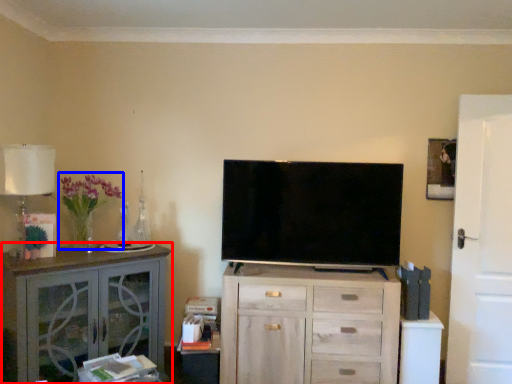
Question: Which object appears closest to the camera in this image, cabinetry (highlighted by a red box) or flower (highlighted by a blue box)?

Choices:
 (A) cabinetry
 (B) flower

Answer: (A)